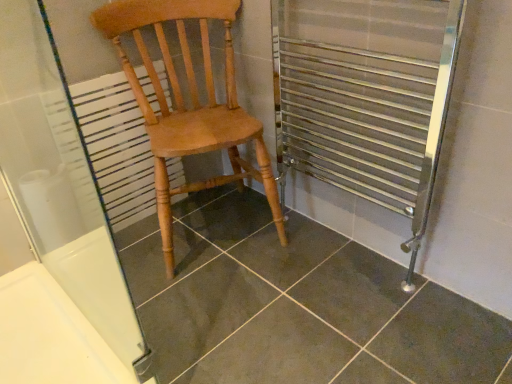
At what (x,y) coordinates should I click in order to perform the action: click on vacant space in light brown wood chair at center (from a real-world perspective). Please return your answer as a coordinate pair (x, y). Image resolution: width=512 pixels, height=384 pixels. Looking at the image, I should click on (215, 220).